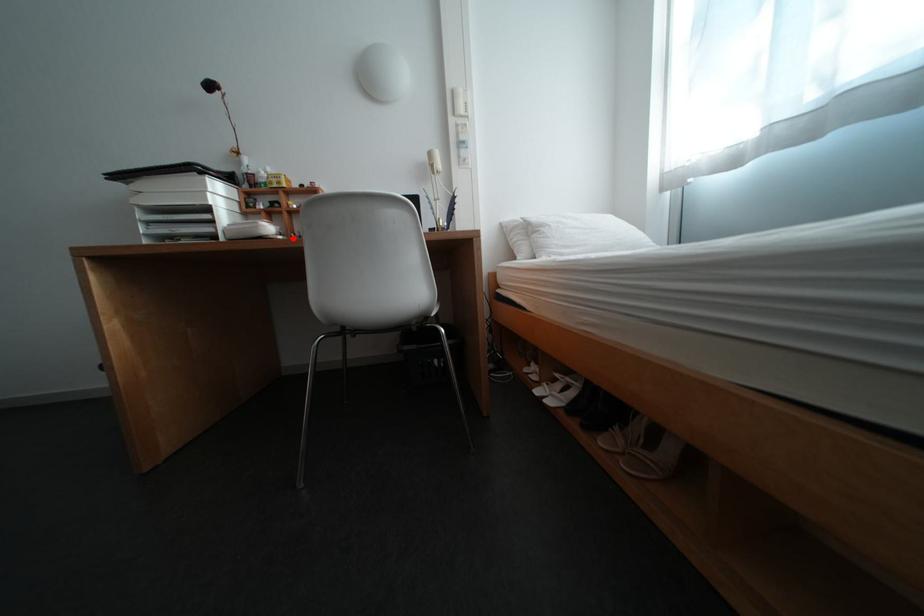
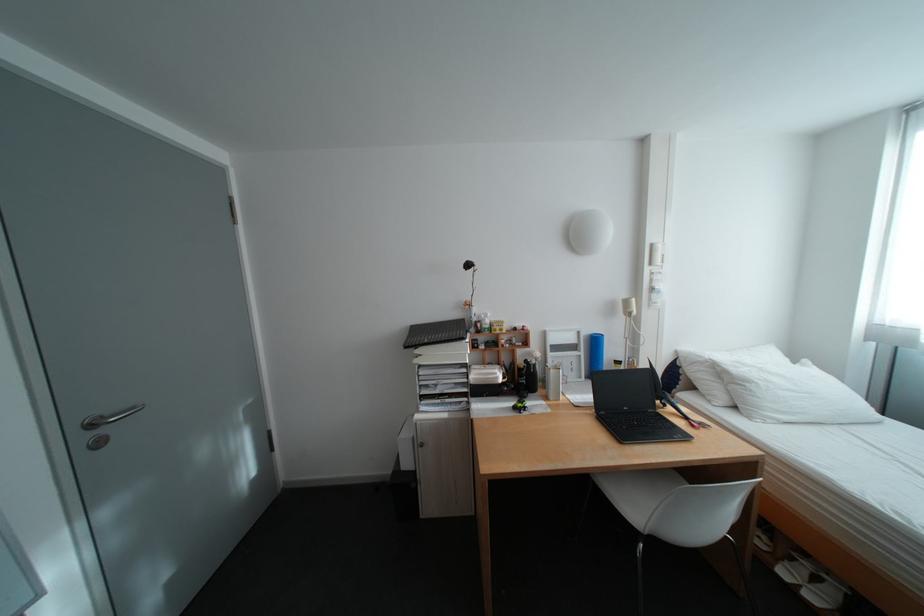
Locate, in the second image, the point that corresponds to the highlighted location in the first image.

(518, 381)